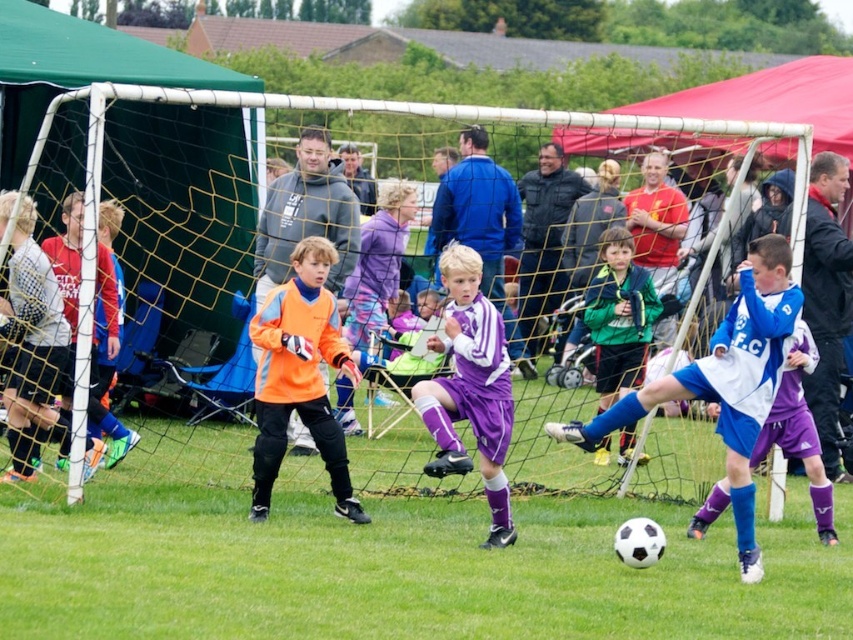
Consider the image. You are a soccer coach observing the game. You notice two players, the blue jersey at center and the orange matte jersey at center. Which player is positioned higher up in the image?

The blue jersey at center is positioned higher up in the image as it is above the orange matte jersey at center.

Based on the coordinates provided, where is the blue jersey at center located in the image?

The blue jersey at center is located at the coordinates point (724, 380).